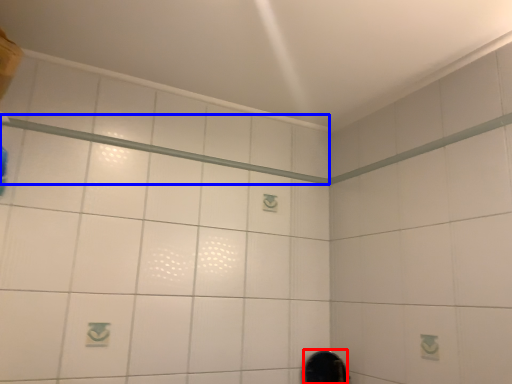
Question: Which point is further to the camera, mirror (highlighted by a red box) or shower (highlighted by a blue box)?

Choices:
 (A) mirror
 (B) shower

Answer: (A)